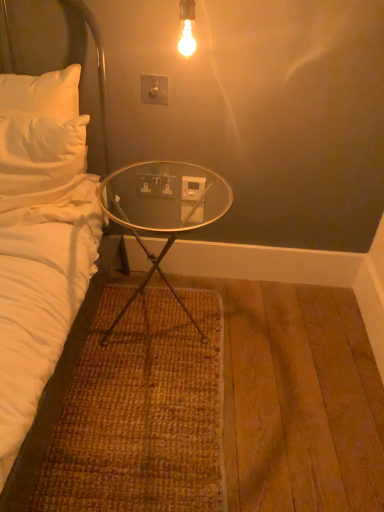
You are a GUI agent. You are given a task and a screenshot of the screen. Output one action in this format:
    pyautogui.click(x=<x>, y=<y>)
    Task: Click on the free point below transparent glass table at center (from a real-world perspective)
    Image resolution: width=384 pixels, height=512 pixels.
    Given the screenshot: What is the action you would take?
    pyautogui.click(x=165, y=324)